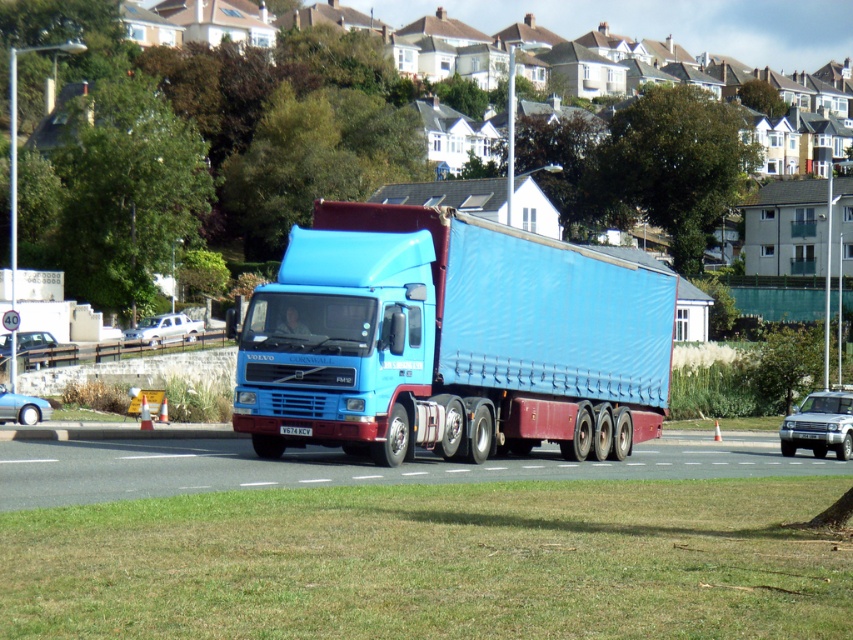
You are a delivery driver who needs to park your blue Volvo FH16 truck between the white matte sedan at left and the metallic blue sedan at lower left. Based on their sizes, which sedan should you position your truck closer to?

The white matte sedan at left is larger in size compared to the metallic blue sedan at lower left. To ensure proper parking space, you should position your truck closer to the metallic blue sedan at lower left since it takes up less space.

You are the driver of the blue Volvo FH16 truck and you want to make a U turn. Is there enough space between the blue Volvo FH16 truck and the white matte sedan at left to do so?

The white matte sedan at left is positioned at point (165, 328), so there is enough space between the blue Volvo FH16 truck and the white matte sedan at left to make a U turn.

You are a delivery driver planning to park your truck behind the white matte sedan at left and the metallic blue sedan at lower left. Which car should you park behind to ensure your truck can fit without hitting the vehicle in front?

You should park behind the white matte sedan at left because it has a greater height compared to the metallic blue sedan at lower left, allowing more clearance for the truck.